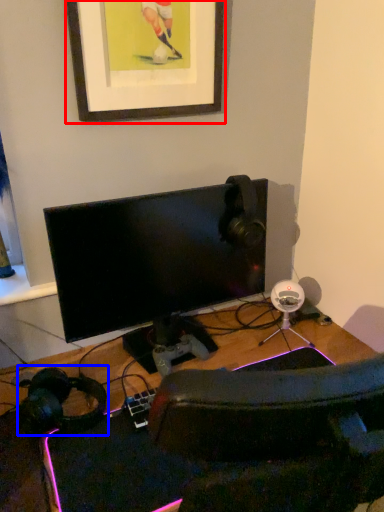
Question: Which point is closer to the camera, picture frame (highlighted by a red box) or headphones (highlighted by a blue box)?

Choices:
 (A) picture frame
 (B) headphones

Answer: (B)